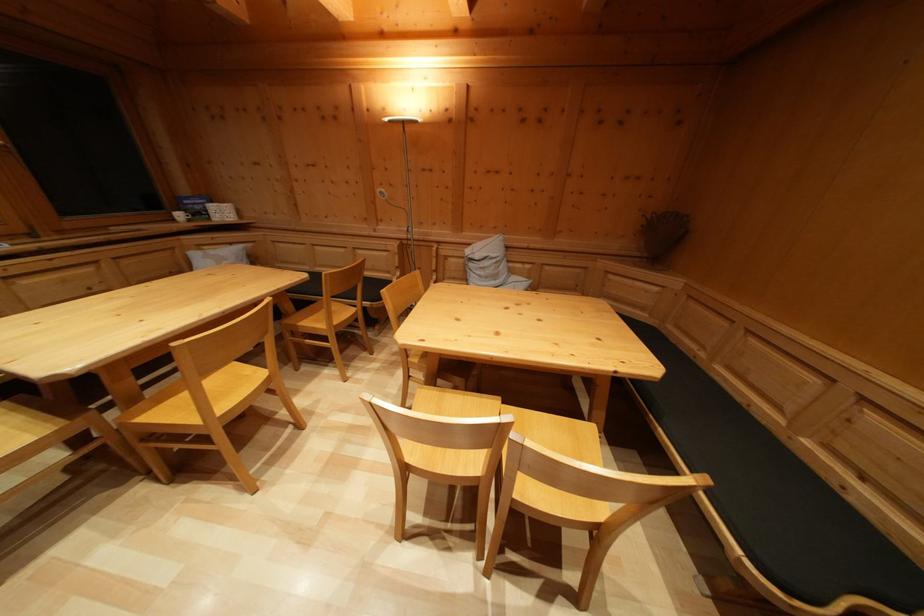
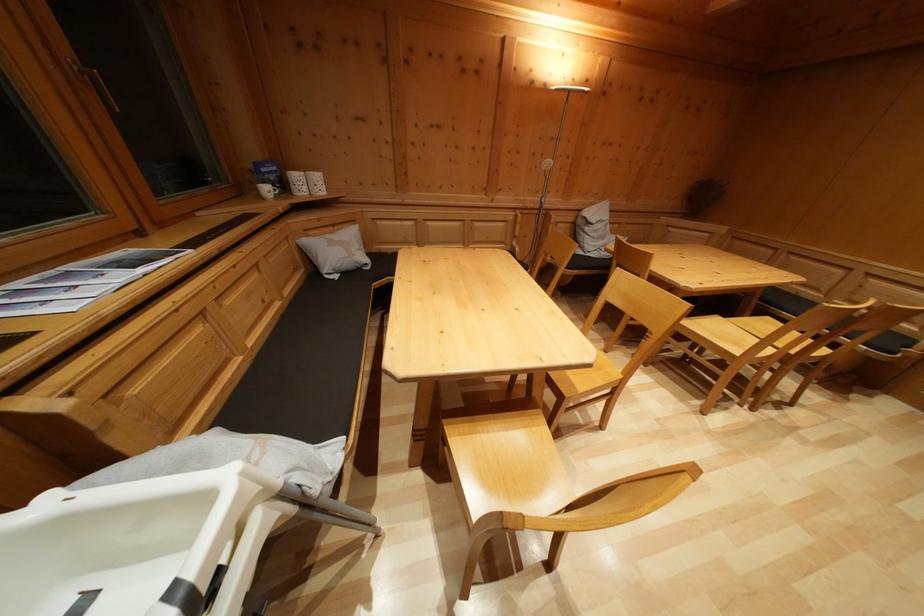
Locate, in the second image, the point that corresponds to point (78, 426) in the first image.

(541, 415)